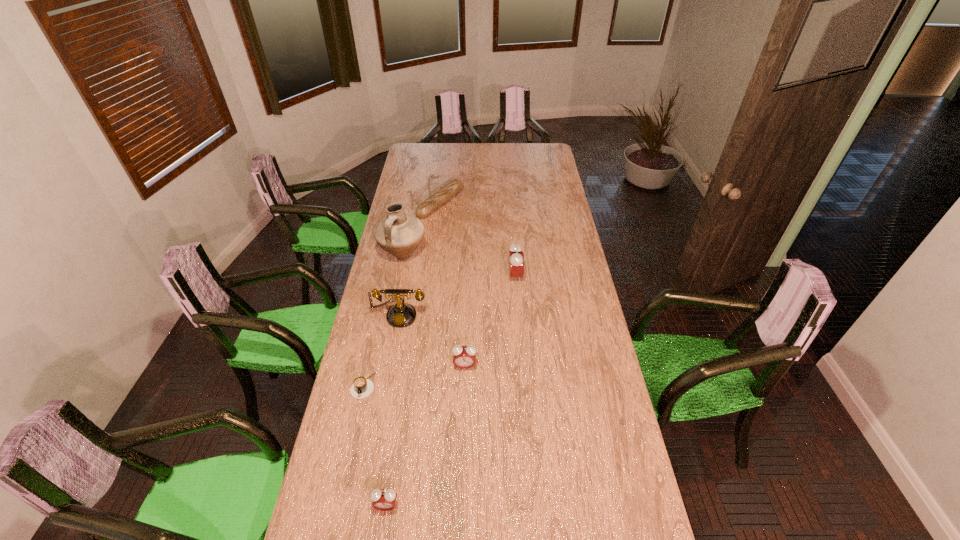
Find the location of a particular element. vacant space in between the second alarm clock from left to right and the farthest object is located at coordinates tap(453, 285).

You are a GUI agent. You are given a task and a screenshot of the screen. Output one action in this format:
    pyautogui.click(x=<x>, y=<y>)
    Task: Click on the blank region between the pitcher and the third nearest object
    
    Given the screenshot: What is the action you would take?
    pyautogui.click(x=434, y=311)

Find the location of a particular element. The height and width of the screenshot is (540, 960). vacant space that is in between the sixth farthest object and the second shortest object is located at coordinates (402, 294).

Where is `vacant point located between the nearest alarm clock and the fourth nearest object`? The width and height of the screenshot is (960, 540). vacant point located between the nearest alarm clock and the fourth nearest object is located at coordinates coord(394,410).

The height and width of the screenshot is (540, 960). Find the location of `free space between the shortest alarm clock and the farthest object`. free space between the shortest alarm clock and the farthest object is located at coordinates (414, 355).

Where is `vacant space that's between the telephone and the third nearest object`? This screenshot has width=960, height=540. vacant space that's between the telephone and the third nearest object is located at coordinates (433, 340).

Find the location of a particular element. free space that is in between the sixth farthest object and the second shortest object is located at coordinates (402, 294).

This screenshot has height=540, width=960. In order to click on vacant space that is in between the rightmost object and the nearest alarm clock in this screenshot , I will do click(451, 392).

Locate which object is the second closest to the rightmost alarm clock. Please provide its 2D coordinates. Your answer should be formatted as a tuple, i.e. [(x, y)], where the tuple contains the x and y coordinates of a point satisfying the conditions above.

[(399, 234)]

Find the location of `object that is the fifth closest to the fourth nearest object`. object that is the fifth closest to the fourth nearest object is located at coordinates (433, 202).